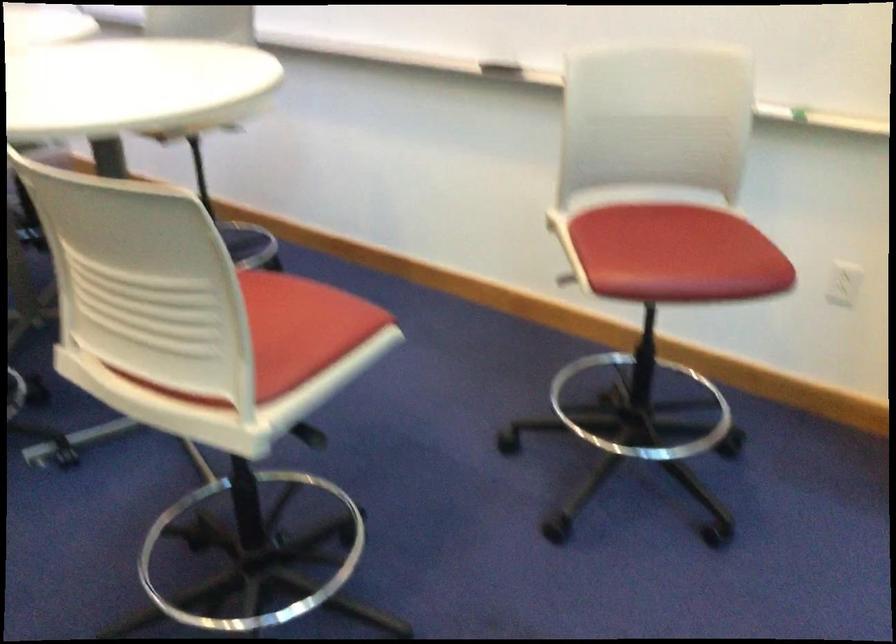
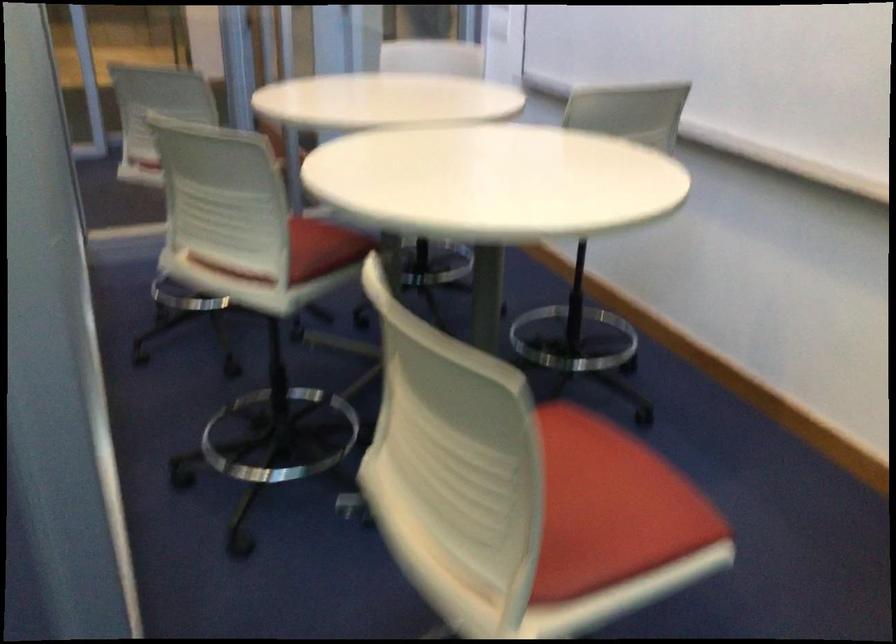
Question: How did the camera likely rotate?

Choices:
 (A) Left
 (B) Right
 (C) Up
 (D) Down

Answer: (A)